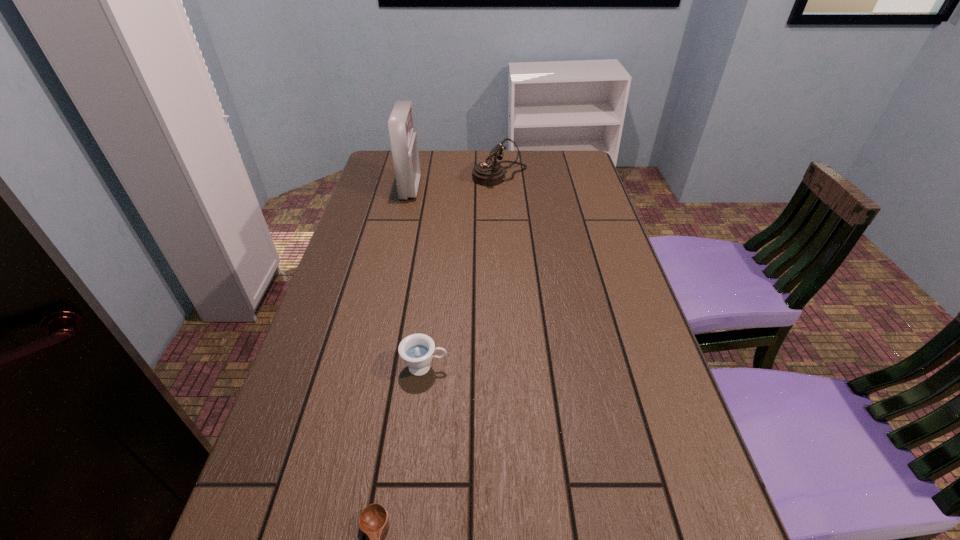
The width and height of the screenshot is (960, 540). What are the coordinates of `empty space between the tallest object and the telephone` in the screenshot? It's located at (455, 181).

This screenshot has width=960, height=540. Find the location of `object that can be found as the third closest to the teacup`. object that can be found as the third closest to the teacup is located at coordinates (489, 173).

Where is `object that stands as the closest to the teacup`? The image size is (960, 540). object that stands as the closest to the teacup is located at coordinates (373, 521).

Identify the location of vacant area in the image that satisfies the following two spatial constraints: 1. on the front side of the telephone; 2. on the side of the third farthest object with the handle. This screenshot has width=960, height=540. (513, 367).